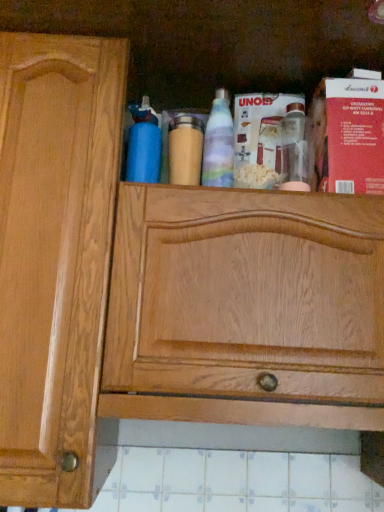
Question: Considering the relative sizes of wooden bottle at center, which ranks as the second bottle in left-to-right order, and translucent plastic bottle at center, the first bottle viewed from the right, in the image provided, is wooden bottle at center, which ranks as the second bottle in left-to-right order, wider than translucent plastic bottle at center, the first bottle viewed from the right,?

Choices:
 (A) yes
 (B) no

Answer: (A)

Question: Is wooden bottle at center, which ranks as the second bottle in left-to-right order, at the left side of translucent plastic bottle at center, the first bottle viewed from the right?

Choices:
 (A) yes
 (B) no

Answer: (A)

Question: Is wooden bottle at center, acting as the second bottle starting from the right, next to translucent plastic bottle at center, the first bottle viewed from the right?

Choices:
 (A) no
 (B) yes

Answer: (B)

Question: Can you confirm if wooden bottle at center, which ranks as the second bottle in left-to-right order, is bigger than translucent plastic bottle at center, the first bottle viewed from the right?

Choices:
 (A) yes
 (B) no

Answer: (B)

Question: Can you confirm if wooden bottle at center, acting as the second bottle starting from the right, is thinner than translucent plastic bottle at center, the first bottle viewed from the right?

Choices:
 (A) no
 (B) yes

Answer: (A)

Question: From a real-world perspective, is wooden bottle at center, which ranks as the second bottle in left-to-right order, below translucent plastic bottle at center, positioned as the third bottle in left-to-right order?

Choices:
 (A) yes
 (B) no

Answer: (A)

Question: Is blue matte bottle at upper center, the 1th bottle in the left-to-right sequence, taller than translucent plastic bottle at center, positioned as the third bottle in left-to-right order?

Choices:
 (A) yes
 (B) no

Answer: (B)

Question: Is blue matte bottle at upper center, the 1th bottle in the left-to-right sequence, next to translucent plastic bottle at center, positioned as the third bottle in left-to-right order, and touching it?

Choices:
 (A) yes
 (B) no

Answer: (B)

Question: Is blue matte bottle at upper center, the third bottle viewed from the right, facing towards translucent plastic bottle at center, positioned as the third bottle in left-to-right order?

Choices:
 (A) yes
 (B) no

Answer: (B)

Question: From a real-world perspective, does blue matte bottle at upper center, the third bottle viewed from the right, sit lower than translucent plastic bottle at center, the first bottle viewed from the right?

Choices:
 (A) no
 (B) yes

Answer: (B)

Question: From the image's perspective, is blue matte bottle at upper center, the third bottle viewed from the right, on translucent plastic bottle at center, the first bottle viewed from the right?

Choices:
 (A) yes
 (B) no

Answer: (B)

Question: Considering the relative sizes of blue matte bottle at upper center, the third bottle viewed from the right, and translucent plastic bottle at center, the first bottle viewed from the right, in the image provided, is blue matte bottle at upper center, the third bottle viewed from the right, wider than translucent plastic bottle at center, the first bottle viewed from the right,?

Choices:
 (A) yes
 (B) no

Answer: (A)

Question: Is blue matte bottle at upper center, the 1th bottle in the left-to-right sequence, bigger than wooden bottle at center, which ranks as the second bottle in left-to-right order?

Choices:
 (A) yes
 (B) no

Answer: (A)